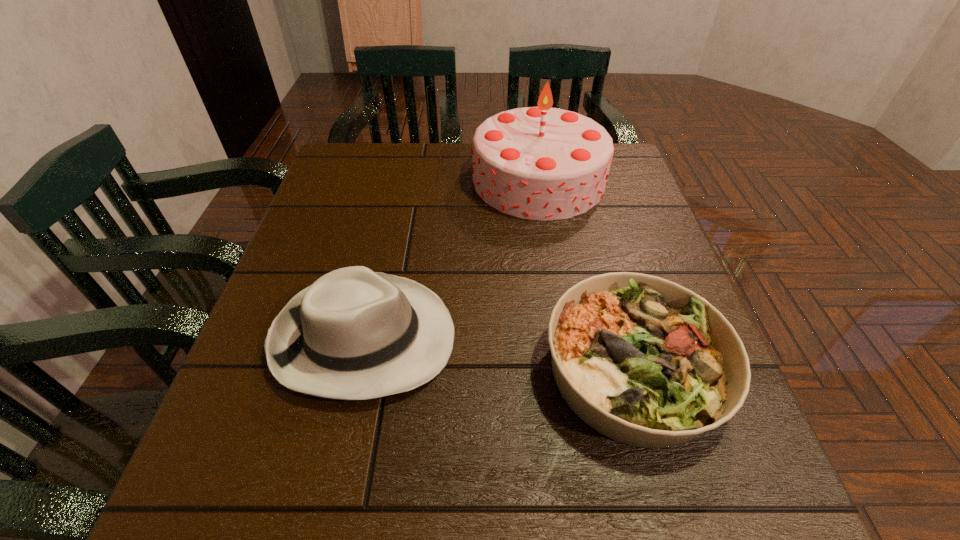
This screenshot has width=960, height=540. What are the coordinates of `free space at the far right corner of the desktop` in the screenshot? It's located at (628, 164).

You are a GUI agent. You are given a task and a screenshot of the screen. Output one action in this format:
    pyautogui.click(x=<x>, y=<y>)
    Task: Click on the free space between the leftmost object and the farthest object
    The image size is (960, 540).
    Given the screenshot: What is the action you would take?
    pyautogui.click(x=451, y=259)

At what (x,y) coordinates should I click in order to perform the action: click on free space between the salad plate and the fedora. Please return your answer as a coordinate pair (x, y). Looking at the image, I should click on (499, 354).

Image resolution: width=960 pixels, height=540 pixels. What are the coordinates of `free spot between the salad plate and the farthest object` in the screenshot? It's located at (586, 274).

This screenshot has width=960, height=540. What are the coordinates of `vacant space in between the birthday cake and the shortest object` in the screenshot? It's located at (586, 274).

The image size is (960, 540). I want to click on empty location between the farthest object and the shortest object, so click(x=586, y=274).

The height and width of the screenshot is (540, 960). I want to click on free area in between the salad plate and the second shortest object, so click(x=499, y=354).

The image size is (960, 540). What are the coordinates of `vacant space that is in between the leftmost object and the birthday cake` in the screenshot? It's located at (451, 259).

Identify the location of free space between the salad plate and the second tallest object. The height and width of the screenshot is (540, 960). (499, 354).

Locate an element on the screen. free space between the fedora and the shortest object is located at coordinates (499, 354).